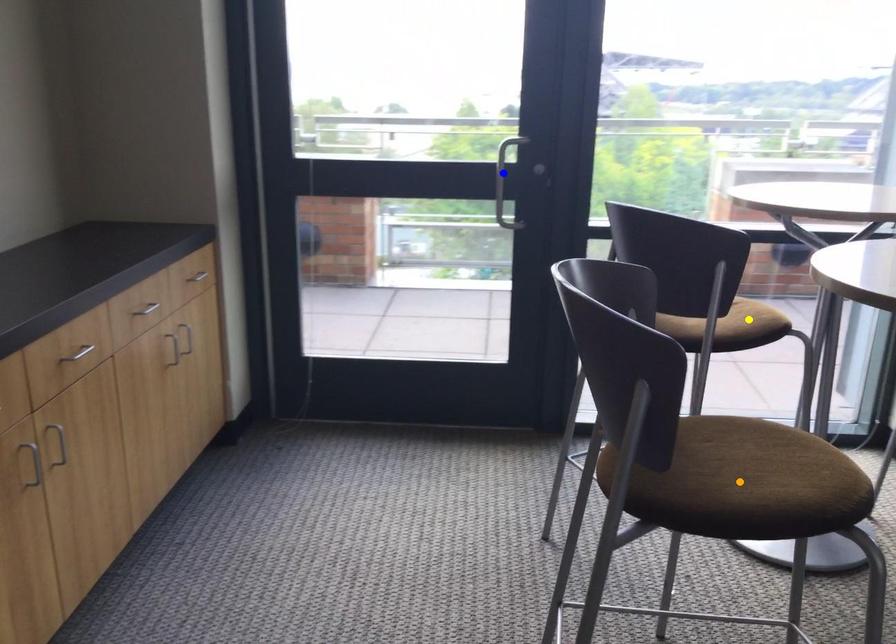
Order these from nearest to farthest:
orange point | blue point | yellow point

Answer: orange point < yellow point < blue point